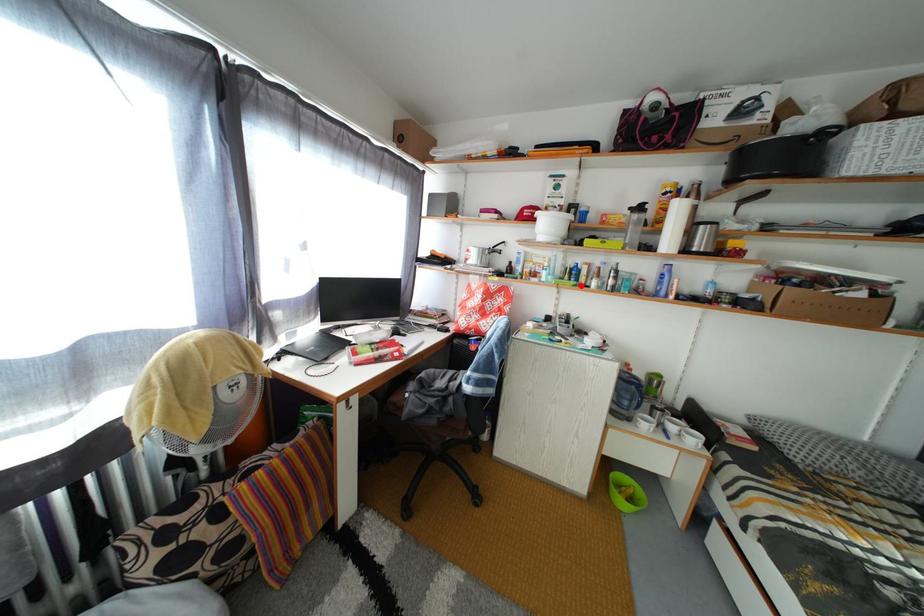
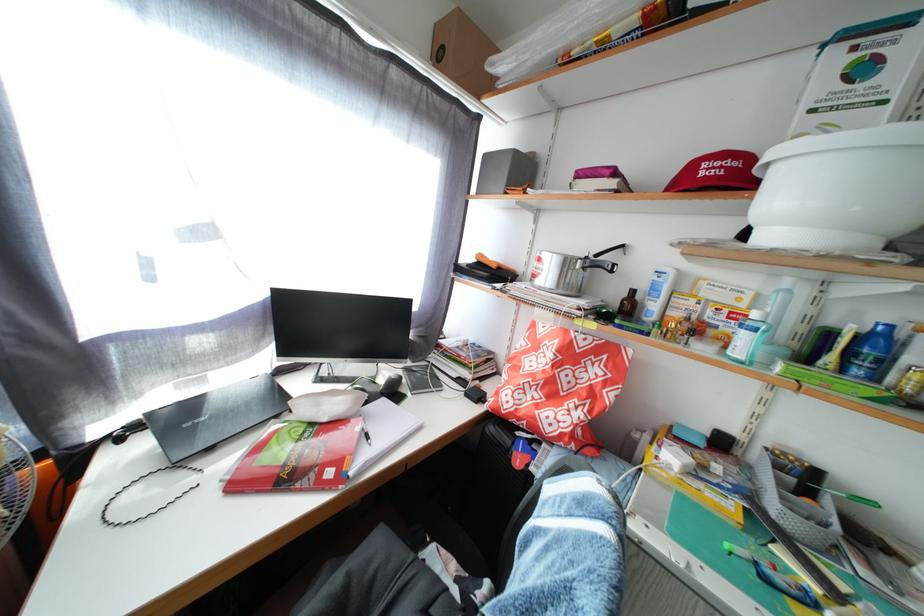
Question: I am providing you with two images of the same scene from different viewpoints. Given a red point in image1, look at the same physical point in image2. Is it:

Choices:
 (A) Closer to the viewpoint
 (B) Farther from the viewpoint

Answer: (B)